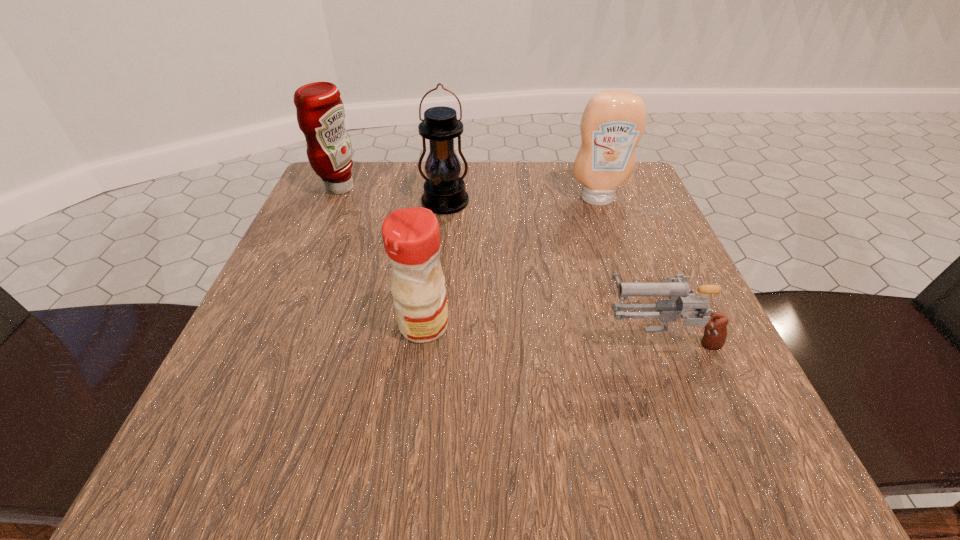
Find the location of a particular element. Image resolution: width=960 pixels, height=540 pixels. free space between the leftmost object and the gun is located at coordinates (499, 262).

Find the location of a particular element. vacant area between the second condiment from right to left and the shortest object is located at coordinates [x=541, y=331].

Where is `vacant area that lies between the gun and the rightmost condiment`? The height and width of the screenshot is (540, 960). vacant area that lies between the gun and the rightmost condiment is located at coordinates (629, 268).

I want to click on vacant area that lies between the nearest condiment and the shortest object, so click(541, 331).

Find the location of a particular element. The height and width of the screenshot is (540, 960). unoccupied position between the lantern and the leftmost condiment is located at coordinates (393, 195).

Identify the location of the closest object to the leftmost condiment. The height and width of the screenshot is (540, 960). (444, 191).

The width and height of the screenshot is (960, 540). What are the coordinates of `object that can be found as the third closest to the lantern` in the screenshot? It's located at (411, 236).

Locate which condiment ranks second in proximity to the lantern. Please provide its 2D coordinates. Your answer should be formatted as a tuple, i.e. [(x, y)], where the tuple contains the x and y coordinates of a point satisfying the conditions above.

[(613, 122)]

Identify which condiment is the nearest to the lantern. Please provide its 2D coordinates. Your answer should be formatted as a tuple, i.e. [(x, y)], where the tuple contains the x and y coordinates of a point satisfying the conditions above.

[(320, 112)]